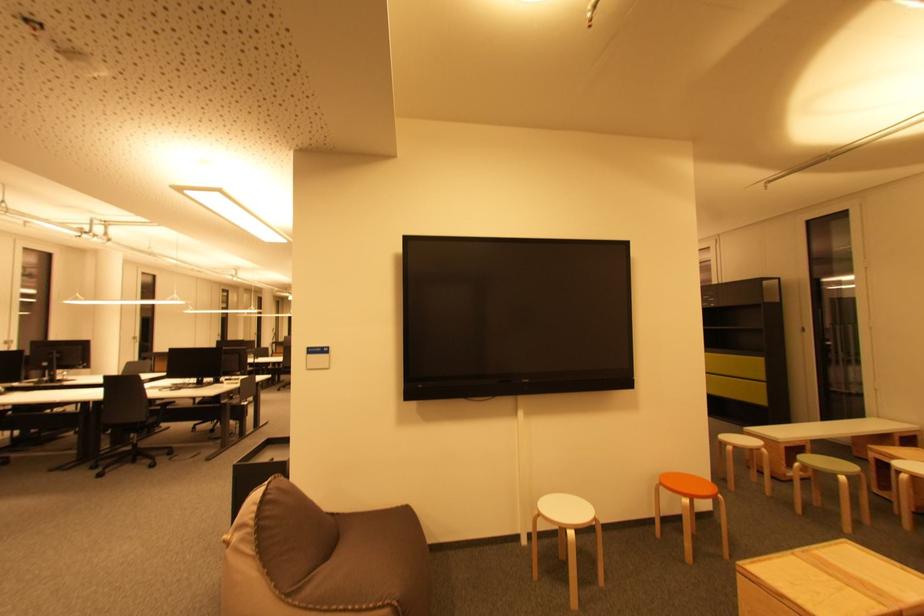
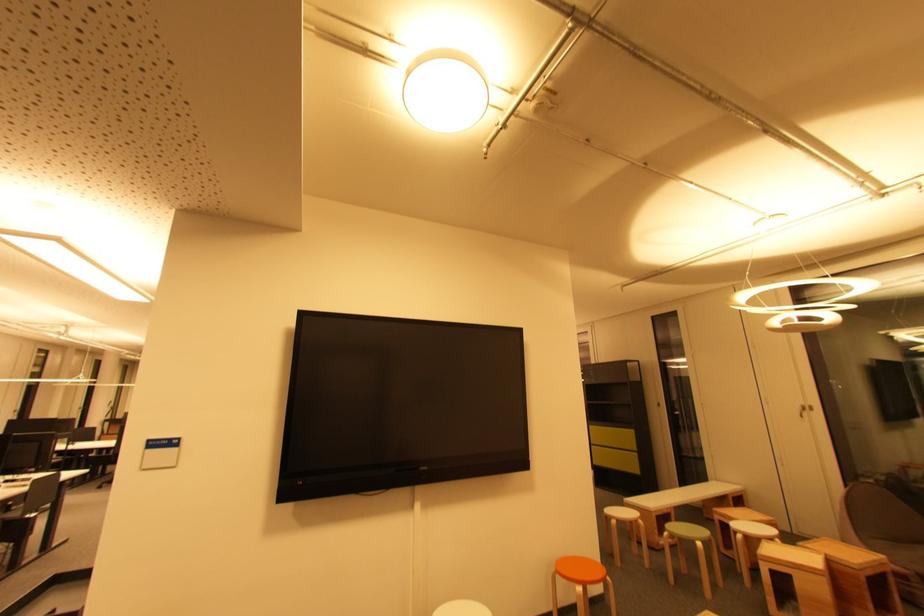
Question: The camera is either moving clockwise (left) or counter-clockwise (right) around the object. The first image is from the beginning of the video and the second image is from the end. Is the camera moving left or right when shooting the video?

Choices:
 (A) Left
 (B) Right

Answer: (A)